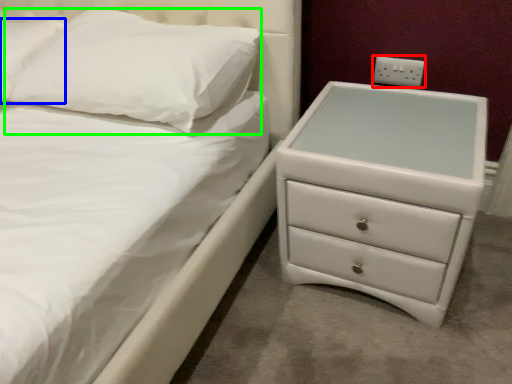
Question: Which object is the closest to the electric outlet (highlighted by a red box)? Choose among these: pillow (highlighted by a blue box) or pillow (highlighted by a green box).

Choices:
 (A) pillow
 (B) pillow

Answer: (B)